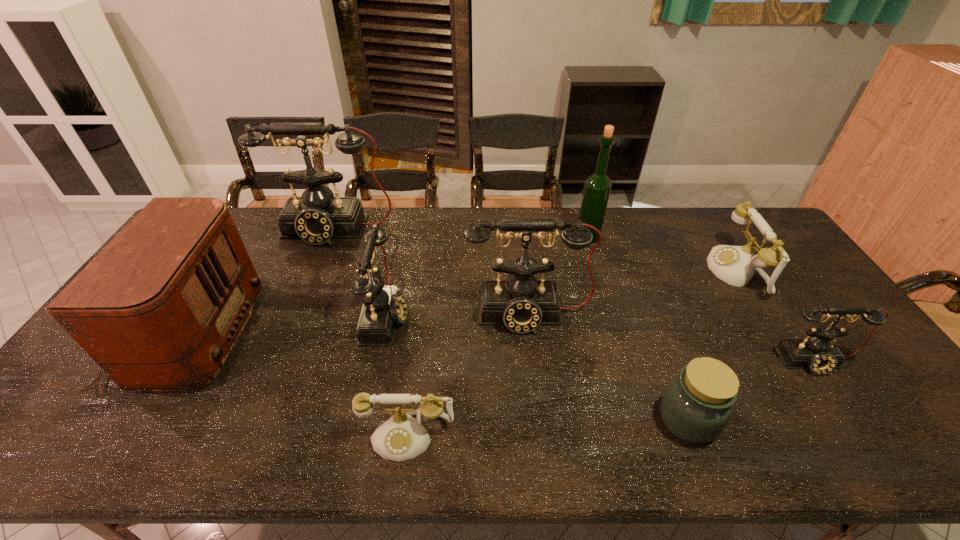
You are a GUI agent. You are given a task and a screenshot of the screen. Output one action in this format:
    pyautogui.click(x=<x>, y=<y>)
    Task: Click on the free space that is in between the tallest telephone and the smallest black telephone
    The height and width of the screenshot is (540, 960).
    Given the screenshot: What is the action you would take?
    pos(574,296)

What are the coordinates of `free area in between the second biggest black telephone and the liquor` in the screenshot? It's located at coord(558,276).

Image resolution: width=960 pixels, height=540 pixels. In order to click on the eighth closest object to the tallest telephone in this screenshot , I will do tap(818, 352).

Point out which object is positioned as the fifth nearest to the farther white telephone. Please provide its 2D coordinates. Your answer should be formatted as a tuple, i.e. [(x, y)], where the tuple contains the x and y coordinates of a point satisfying the conditions above.

[(402, 437)]

Identify which telephone is located as the third nearest to the nearer white telephone. Please provide its 2D coordinates. Your answer should be formatted as a tuple, i.e. [(x, y)], where the tuple contains the x and y coordinates of a point satisfying the conditions above.

[(317, 217)]

Locate which telephone ranks fifth in proximity to the fifth object from right to left. Please provide its 2D coordinates. Your answer should be formatted as a tuple, i.e. [(x, y)], where the tuple contains the x and y coordinates of a point satisfying the conditions above.

[(818, 352)]

Identify which black telephone is the second closest to the farther white telephone. Please provide its 2D coordinates. Your answer should be formatted as a tuple, i.e. [(x, y)], where the tuple contains the x and y coordinates of a point satisfying the conditions above.

[(521, 303)]

Choose which black telephone is the nearest neighbor to the fourth shortest telephone. Please provide its 2D coordinates. Your answer should be formatted as a tuple, i.e. [(x, y)], where the tuple contains the x and y coordinates of a point satisfying the conditions above.

[(317, 217)]

Image resolution: width=960 pixels, height=540 pixels. Identify the location of vacant space that satisfies the following two spatial constraints: 1. on the dial of the farthest black telephone; 2. on the front panel of the radio receiver. (292, 333).

Find the location of a particular element. This screenshot has height=540, width=960. free spot that satisfies the following two spatial constraints: 1. on the front panel of the green jar; 2. on the right side of the brown radio receiver is located at coordinates (133, 420).